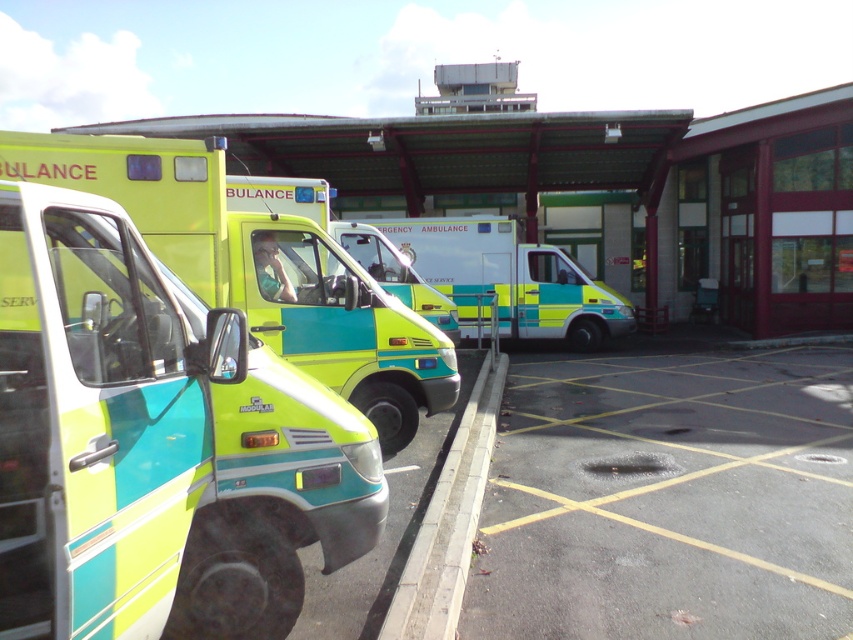
Which is behind, point (747, 406) or point (474, 330)?

Positioned behind is point (474, 330).

Is dark gray asphalt at lower right above yellow-green plastic ambulance at center?

Actually, dark gray asphalt at lower right is below yellow-green plastic ambulance at center.

Is point (647, 560) positioned after point (505, 275)?

No, it is not.

Locate an element on the screen. The image size is (853, 640). dark gray asphalt at lower right is located at coordinates (669, 499).

Can you confirm if yellow-green plastic ambulance at center is shorter than matte green and yellow ambulance at center?

In fact, yellow-green plastic ambulance at center may be taller than matte green and yellow ambulance at center.

The width and height of the screenshot is (853, 640). Identify the location of yellow-green plastic ambulance at center. click(509, 280).

Is point (556, 269) closer to viewer compared to point (332, 220)?

No, (556, 269) is behind (332, 220).

At what (x,y) coordinates should I click in order to perform the action: click on yellow-green plastic ambulance at center. Please return your answer as a coordinate pair (x, y). This screenshot has height=640, width=853. Looking at the image, I should click on (509, 280).

Between point (144, 509) and point (579, 532), which one is positioned in front?

Point (144, 509) is in front.

Who is higher up, matte green and blue ambulance at left or dark gray asphalt at lower right?

matte green and blue ambulance at left

Between point (212, 465) and point (666, 586), which one is positioned behind?

The point (666, 586) is more distant.

Locate an element on the screen. matte green and blue ambulance at left is located at coordinates (155, 444).